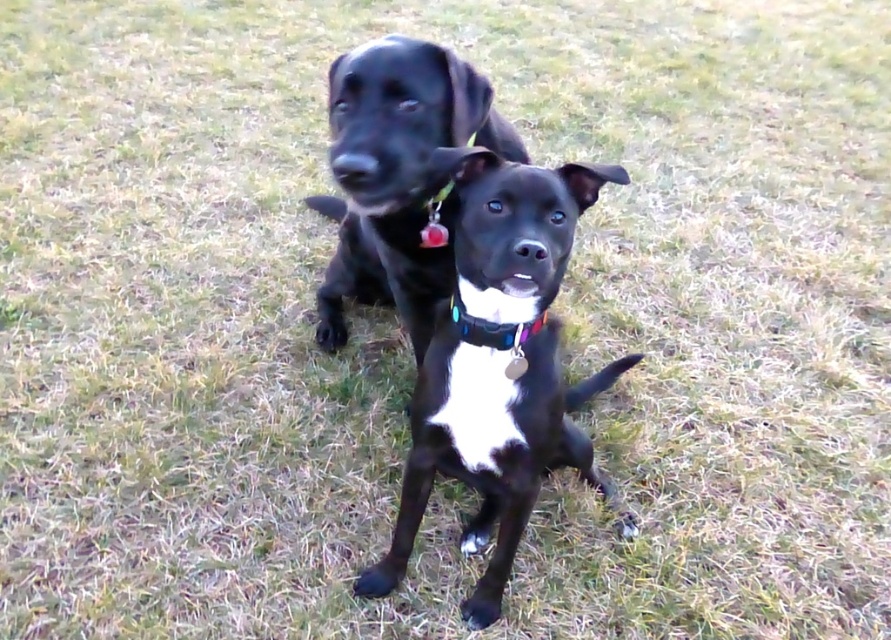
Question: Which object is the farthest from the black shiny dog at center?

Choices:
 (A) shiny black dog at center
 (B) multicolored fabric neckband at center

Answer: (A)

Question: Is black shiny dog at center smaller than shiny black dog at center?

Choices:
 (A) yes
 (B) no

Answer: (B)

Question: Considering the real-world distances, which object is farthest from the multicolored fabric neckband at center?

Choices:
 (A) shiny black dog at center
 (B) black shiny dog at center

Answer: (A)

Question: Observing the image, what is the correct spatial positioning of shiny black dog at center in reference to multicolored fabric neckband at center?

Choices:
 (A) right
 (B) left

Answer: (B)

Question: Can you confirm if black shiny dog at center is positioned above shiny black dog at center?

Choices:
 (A) yes
 (B) no

Answer: (B)

Question: Estimate the real-world distances between objects in this image. Which object is closer to the black shiny dog at center?

Choices:
 (A) multicolored fabric neckband at center
 (B) shiny black dog at center

Answer: (A)